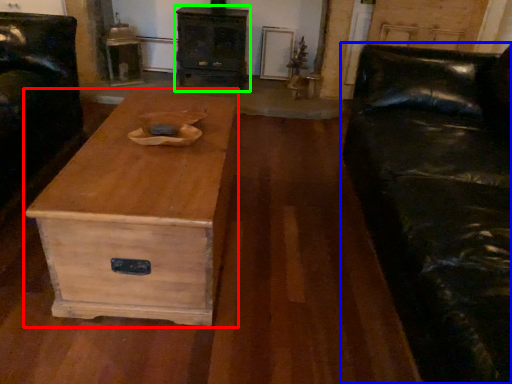
Question: Considering the real-world distances, which object is farthest from coffee table (highlighted by a red box)? studio couch (highlighted by a blue box) or chest of drawers (highlighted by a green box)?

Choices:
 (A) studio couch
 (B) chest of drawers

Answer: (B)